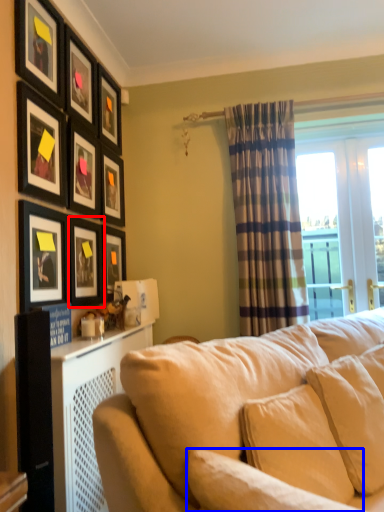
Question: Which object appears closest to the camera in this image, picture frame (highlighted by a red box) or pillow (highlighted by a blue box)?

Choices:
 (A) picture frame
 (B) pillow

Answer: (B)